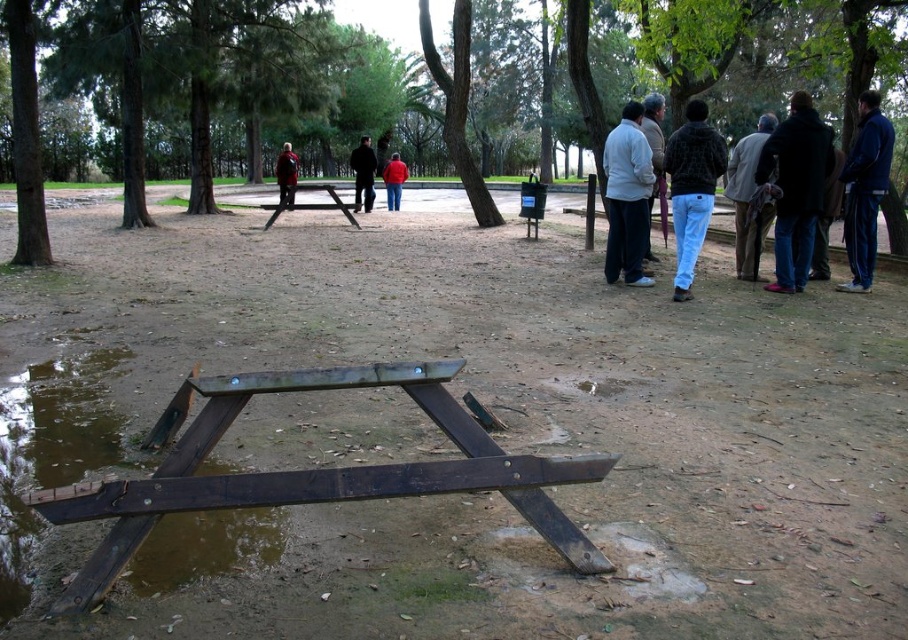
From the picture: You are planning to take a photo of the black fuzzy jacket at right and the dark blue jeans at center. Which clothing item is narrower in width?

The black fuzzy jacket at right is narrower in width than the dark blue jeans at center.

You are a photographer trying to capture a shot of the black leather jacket at right from the left side of the scene. Based on its 2D coordinates, can you estimate whether the jacket is positioned more to the left or right side of the image?

The black leather jacket at right is located at the coordinates point (826, 220). Since the x coordinate is 0.344, which is less than 0.5, the jacket is positioned more to the left side of the image.

You are standing at the picnic table in the park and want to take a photo of both point (899, 202) and point (306, 204). Which point should you focus on first to ensure both are in clear view?

Answer: You should focus on point (899, 202) first because it is closer to the camera than point (306, 204). This ensures both points will be in focus as the closer object determines the focal plane.